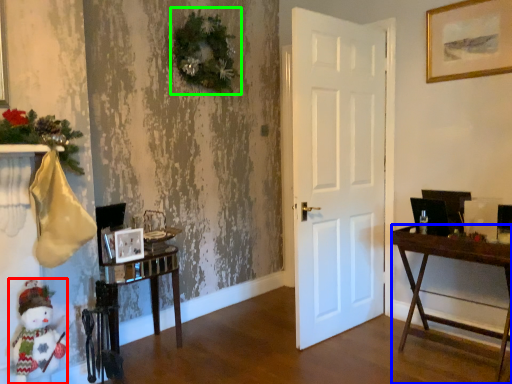
Question: Which is nearer to the doll (highlighted by a red box)? desk (highlighted by a blue box) or christmas decoration (highlighted by a green box).

Choices:
 (A) desk
 (B) christmas decoration

Answer: (B)